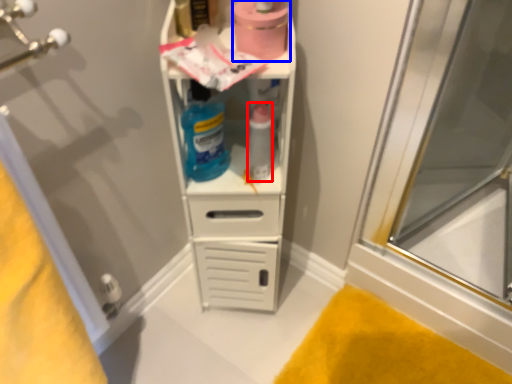
Question: Which object is further to the camera taking this photo, bottle (highlighted by a red box) or toilet paper (highlighted by a blue box)?

Choices:
 (A) bottle
 (B) toilet paper

Answer: (A)